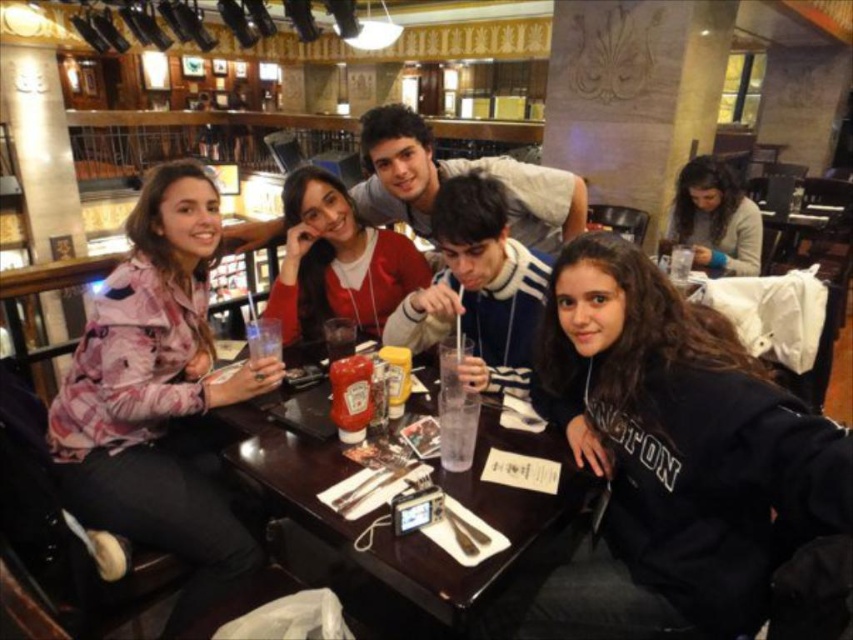
Which of these two, white cotton shirt at center or clear glass at center, stands shorter?

clear glass at center

Does white cotton shirt at center have a lesser height compared to clear glass at center?

No.

The image size is (853, 640). I want to click on white cotton shirt at center, so click(457, 173).

Image resolution: width=853 pixels, height=640 pixels. I want to click on white cotton shirt at center, so click(457, 173).

Who is shorter, black matte sweatshirt at lower right or floral-patterned jacket at left?

With less height is black matte sweatshirt at lower right.

At what (x,y) coordinates should I click in order to perform the action: click on black matte sweatshirt at lower right. Please return your answer as a coordinate pair (x, y). This screenshot has width=853, height=640. Looking at the image, I should click on (677, 445).

Identify the location of black matte sweatshirt at lower right. (677, 445).

Can you confirm if dark brown hair at upper right is thinner than clear glass water at table center?

No, dark brown hair at upper right is not thinner than clear glass water at table center.

Is point (721, 195) less distant than point (445, 364)?

No, (721, 195) is further to viewer.

Is point (712, 237) positioned before point (442, 369)?

No.

The width and height of the screenshot is (853, 640). Find the location of `dark brown hair at upper right`. dark brown hair at upper right is located at coordinates (714, 220).